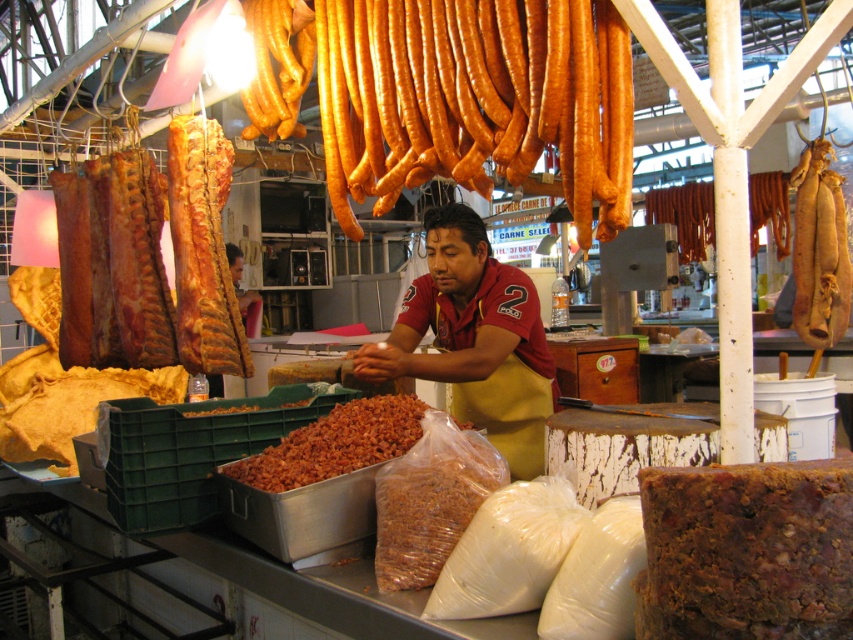
Which is above, shiny brown sausages at upper center or brown matte dried beans at center?

shiny brown sausages at upper center

Is point (463, 97) farther from viewer compared to point (459, 531)?

Yes, point (463, 97) is farther from viewer.

What do you see at coordinates (474, 99) in the screenshot?
I see `shiny brown sausages at upper center` at bounding box center [474, 99].

What are the coordinates of `shiny brown sausages at upper center` in the screenshot? It's located at (474, 99).

Does brown crumbly meatloaf at center appear over brown crumbly food at center?

Incorrect, brown crumbly meatloaf at center is not positioned above brown crumbly food at center.

Which is in front, point (659, 516) or point (254, 404)?

Positioned in front is point (659, 516).

What are the coordinates of `brown crumbly meatloaf at center` in the screenshot? It's located at (747, 552).

Describe the element at coordinates (747, 552) in the screenshot. This screenshot has width=853, height=640. I see `brown crumbly meatloaf at center` at that location.

How much distance is there between brown crumbly meatloaf at center and brown matte dried beans at center?

60.99 centimeters

Who is more forward, (743, 490) or (450, 534)?

Positioned in front is point (743, 490).

The image size is (853, 640). In order to click on brown crumbly meatloaf at center in this screenshot , I will do `click(747, 552)`.